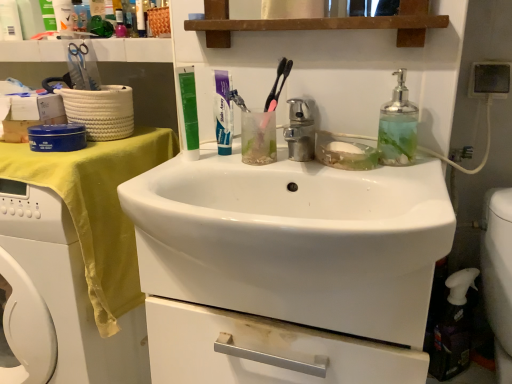
Question: Is white glossy toothpaste at center positioned before yellow fabric at left?

Choices:
 (A) no
 (B) yes

Answer: (A)

Question: Does white glossy toothpaste at center touch yellow fabric at left?

Choices:
 (A) no
 (B) yes

Answer: (A)

Question: Does white glossy toothpaste at center have a greater height compared to yellow fabric at left?

Choices:
 (A) yes
 (B) no

Answer: (B)

Question: From the image's perspective, is white glossy toothpaste at center above yellow fabric at left?

Choices:
 (A) yes
 (B) no

Answer: (A)

Question: From a real-world perspective, is white glossy toothpaste at center located beneath yellow fabric at left?

Choices:
 (A) yes
 (B) no

Answer: (B)

Question: Is point (432, 372) positioned closer to the camera than point (286, 127)?

Choices:
 (A) farther
 (B) closer

Answer: (A)

Question: In terms of height, does white plastic spray bottle at lower right look taller or shorter compared to polished chrome faucet at center?

Choices:
 (A) short
 (B) tall

Answer: (B)

Question: Is white plastic spray bottle at lower right bigger or smaller than polished chrome faucet at center?

Choices:
 (A) small
 (B) big

Answer: (B)

Question: Based on their positions, is white plastic spray bottle at lower right located to the left or right of polished chrome faucet at center?

Choices:
 (A) right
 (B) left

Answer: (A)

Question: Is point (121, 221) positioned closer to the camera than point (193, 155)?

Choices:
 (A) closer
 (B) farther

Answer: (B)

Question: From a real-world perspective, relative to green matte toothpaste tube at upper center, is yellow fabric at left vertically above or below?

Choices:
 (A) above
 (B) below

Answer: (B)

Question: Considering the positions of yellow fabric at left and green matte toothpaste tube at upper center in the image, is yellow fabric at left bigger or smaller than green matte toothpaste tube at upper center?

Choices:
 (A) small
 (B) big

Answer: (B)

Question: Considering their positions, is yellow fabric at left located in front of or behind green matte toothpaste tube at upper center?

Choices:
 (A) behind
 (B) front

Answer: (B)

Question: From the image's perspective, is white glossy sink at center located above or below green matte toothpaste tube at upper center?

Choices:
 (A) below
 (B) above

Answer: (A)

Question: Considering the positions of white glossy sink at center and green matte toothpaste tube at upper center in the image, is white glossy sink at center wider or thinner than green matte toothpaste tube at upper center?

Choices:
 (A) wide
 (B) thin

Answer: (A)